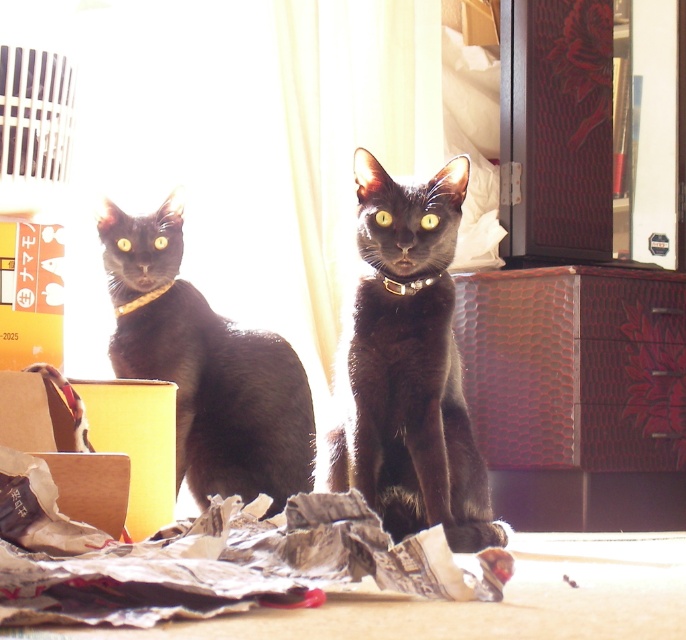
Question: Which point appears farthest from the camera in this image?

Choices:
 (A) (209, 449)
 (B) (153, 289)
 (C) (3, 355)

Answer: (B)

Question: Which point appears farthest from the camera in this image?

Choices:
 (A) (403, 289)
 (B) (147, 488)

Answer: (A)

Question: Does cardboard box at lower left have a larger size compared to metallic gold neckband at left?

Choices:
 (A) no
 (B) yes

Answer: (B)

Question: Can you confirm if matte black cat at center is positioned below yellow cardboard box at lower left?

Choices:
 (A) no
 (B) yes

Answer: (A)

Question: Among these objects, which one is nearest to the camera?

Choices:
 (A) matte black cat at center
 (B) matte black cat at left
 (C) metallic gold neckband at left

Answer: (A)

Question: Is yellow cardboard box at lower left thinner than metallic gold neckband at left?

Choices:
 (A) no
 (B) yes

Answer: (A)